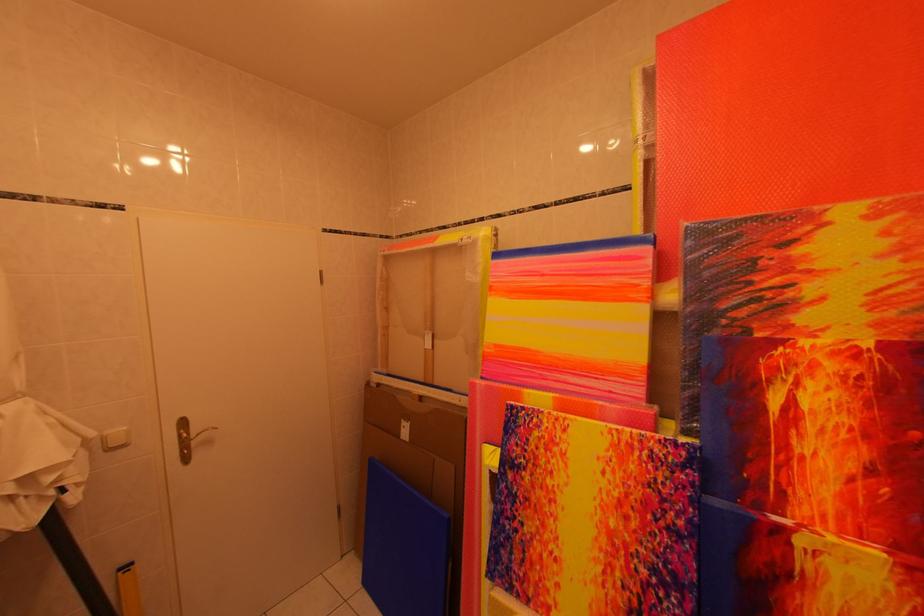
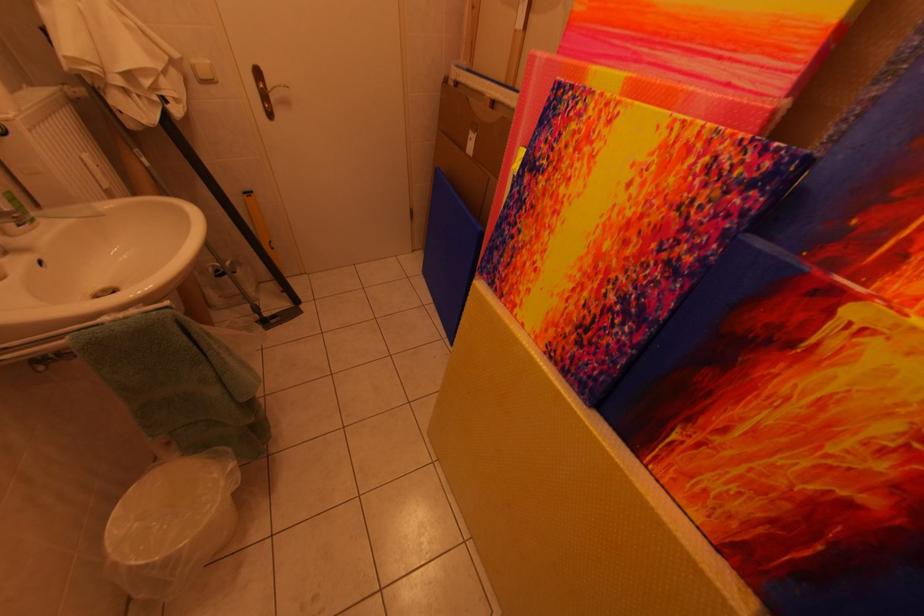
Find the pixel in the second image that matches point (188, 440) in the first image.

(268, 91)